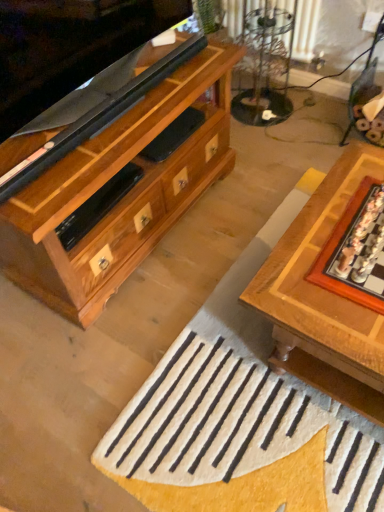
Find the location of a particular element. The image size is (384, 512). vacant space in front of clear glass table at upper center is located at coordinates (277, 145).